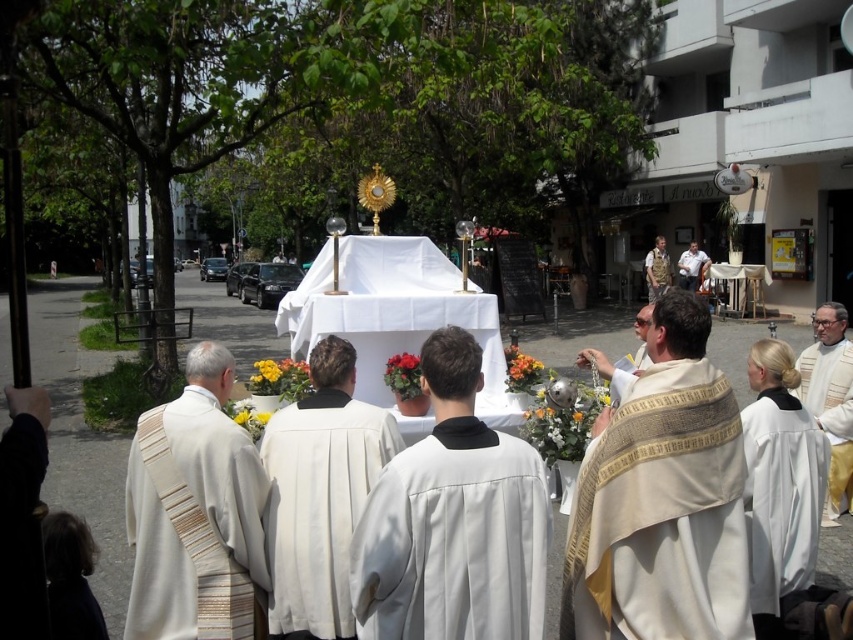
Question: Estimate the real-world distances between objects in this image. Which object is farther from the white textured robe at lower left?

Choices:
 (A) smooth red rose at center
 (B) vibrant orange petals at center
 (C) white textured sash at center

Answer: (B)

Question: Does white textured robe at lower left come behind vibrant orange petals at center?

Choices:
 (A) yes
 (B) no

Answer: (B)

Question: Can you confirm if white textured robe at lower left is positioned to the left of vibrant orange petals at center?

Choices:
 (A) no
 (B) yes

Answer: (B)

Question: Among these objects, which one is nearest to the camera?

Choices:
 (A) white clothed figure at center-right
 (B) white matte robe at center

Answer: (B)

Question: Which object is closer to the camera taking this photo?

Choices:
 (A) white textured robe at center
 (B) white clothed figure at center-right

Answer: (A)

Question: Can you confirm if white satin robe at center is smaller than smooth red rose at center?

Choices:
 (A) yes
 (B) no

Answer: (B)